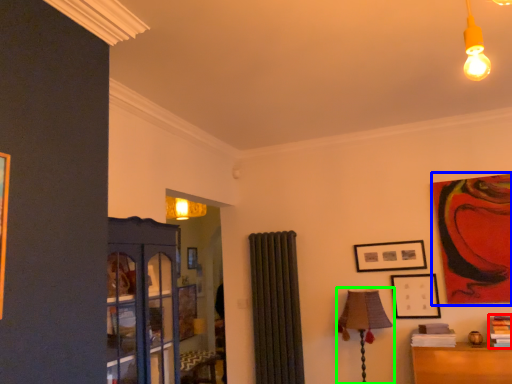
Question: Which is nearer to the book (highlighted by a red box)? picture frame (highlighted by a blue box) or table lamp (highlighted by a green box).

Choices:
 (A) picture frame
 (B) table lamp

Answer: (A)